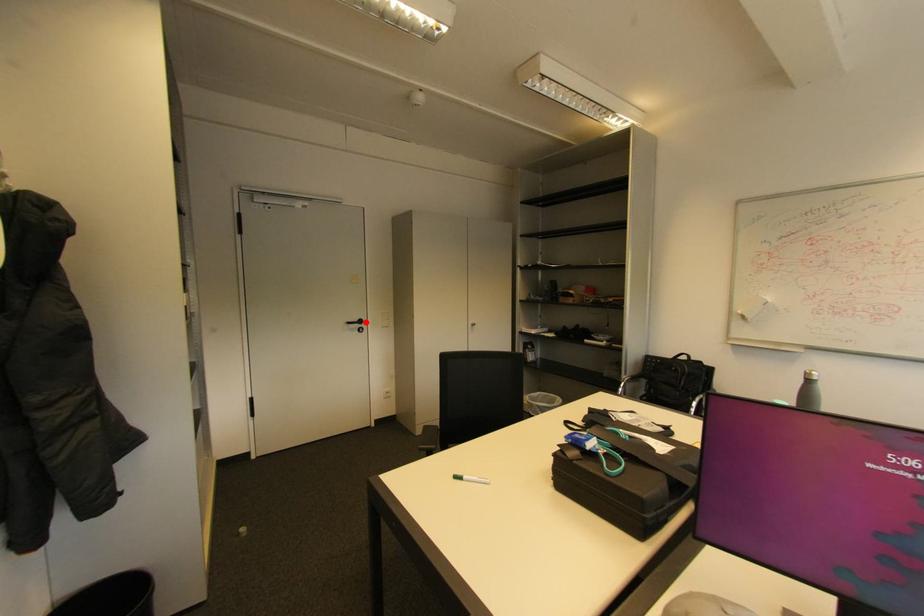
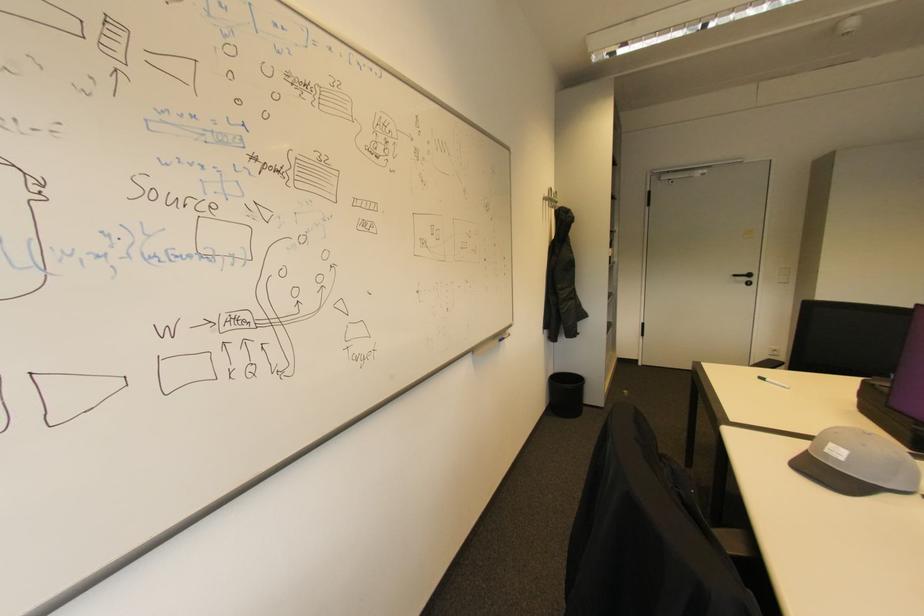
Where in the second image is the point corresponding to the highlighted location from the first image?

(755, 276)